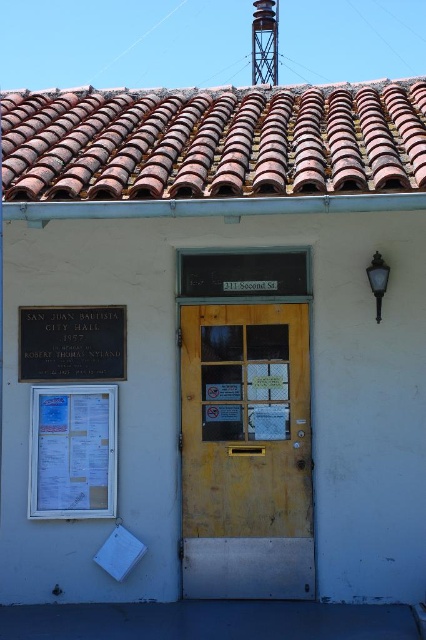
Based on the photo, you are an architect assessing the building for renovations. You need to install a new security camera. The camera must be placed on the side of the yellow wood door at center that is closest to the metallic lattice water tower at upper center. Which side of the door should you choose?

The yellow wood door at center is wider than the metallic lattice water tower at upper center. Since the door is wider, the side closest to the water tower would be the left side of the door if the water tower is positioned to the left, or the right side if it is to the right. However, without specific directional information, the safest assumption based on their widths is to place the camera on the side facing the water tower, ensuring it is within the door frame.